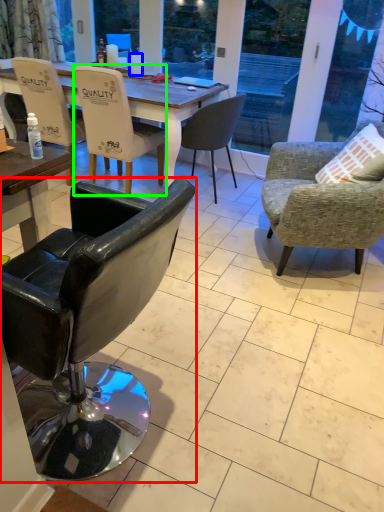
Question: Which object is the farthest from chair (highlighted by a red box)? Choose among these: coffee cup (highlighted by a blue box) or chair (highlighted by a green box).

Choices:
 (A) coffee cup
 (B) chair

Answer: (A)